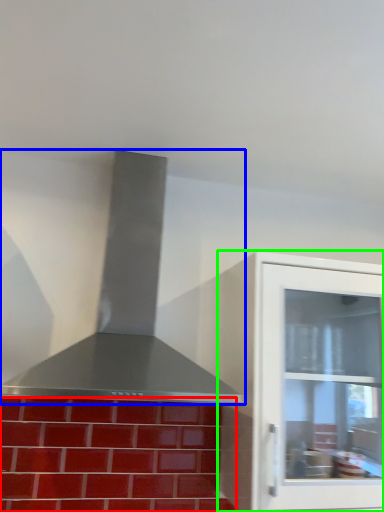
Question: Estimate the real-world distances between objects in this image. Which object is closer to brickwork (highlighted by a red box), vent (highlighted by a blue box) or cabinetry (highlighted by a green box)?

Choices:
 (A) vent
 (B) cabinetry

Answer: (B)